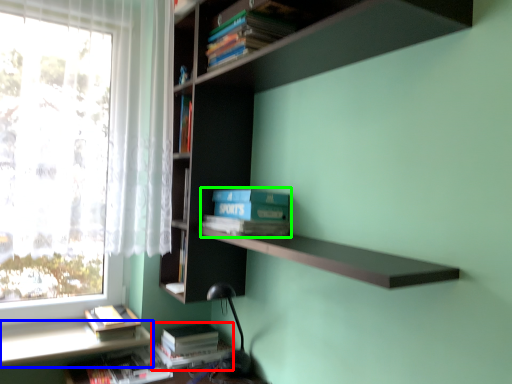
Question: Which is farther away from book (highlighted by a red box)? window sill (highlighted by a blue box) or paperback book (highlighted by a green box)?

Choices:
 (A) window sill
 (B) paperback book

Answer: (B)